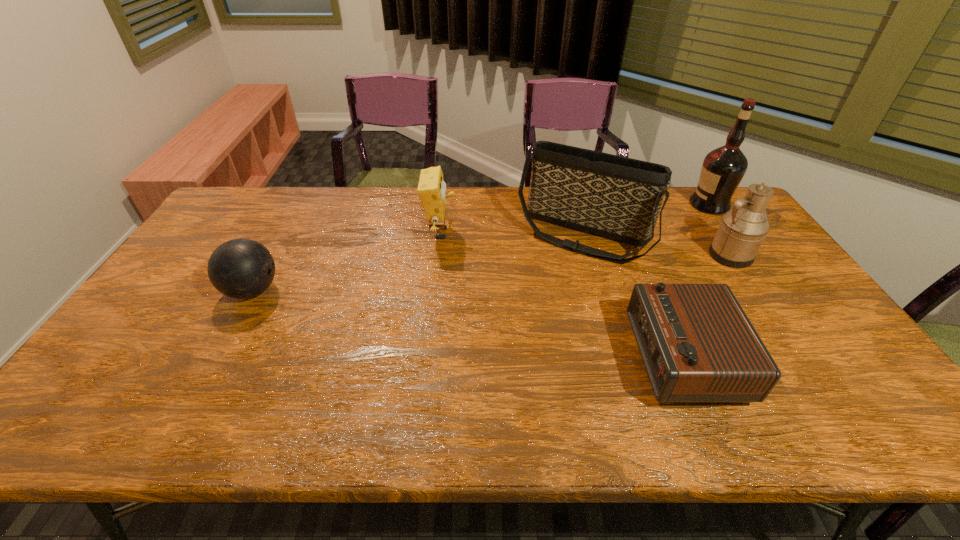
This screenshot has width=960, height=540. I want to click on free space located 0.330m on the surface of the liquor, so click(599, 205).

Locate an element on the screen. vacant space located on the left of the handbag is located at coordinates (496, 235).

The width and height of the screenshot is (960, 540). Find the location of `vacant area situated 0.100m on the left of the pitcher`. vacant area situated 0.100m on the left of the pitcher is located at coordinates (676, 255).

Locate an element on the screen. Image resolution: width=960 pixels, height=540 pixels. free space located 0.090m on the face of the sponge is located at coordinates (483, 234).

The image size is (960, 540). In order to click on free space located on the grip area of the bowling ball in this screenshot , I will do `click(341, 291)`.

At what (x,y) coordinates should I click in order to perform the action: click on vacant space situated 0.190m on the tuning display of the radio receiver. Please return your answer as a coordinate pair (x, y). Looking at the image, I should click on (559, 357).

Find the location of a particular element. This screenshot has width=960, height=540. free space located on the tuning display of the radio receiver is located at coordinates (588, 357).

Locate an element on the screen. free space located on the tuning display of the radio receiver is located at coordinates (506, 357).

The height and width of the screenshot is (540, 960). Find the location of `liquor that is positioned at the far edge`. liquor that is positioned at the far edge is located at coordinates (722, 170).

I want to click on handbag that is at the far edge, so click(x=612, y=196).